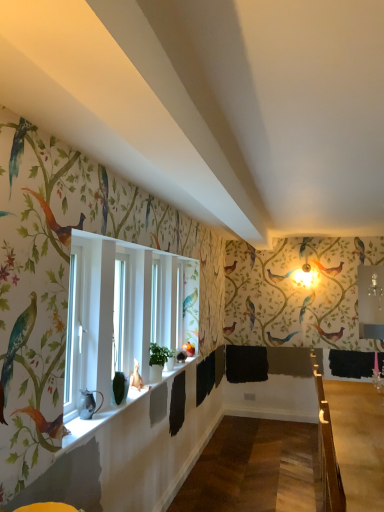
Question: Is white glossy window sill at lower center completely or partially inside matte black pitcher at window?

Choices:
 (A) no
 (B) yes

Answer: (A)

Question: Is matte black pitcher at window thinner than white glossy window sill at lower center?

Choices:
 (A) yes
 (B) no

Answer: (A)

Question: Does matte black pitcher at window have a smaller size compared to white glossy window sill at lower center?

Choices:
 (A) no
 (B) yes

Answer: (B)

Question: Is matte black pitcher at window far away from white glossy window sill at lower center?

Choices:
 (A) yes
 (B) no

Answer: (B)

Question: From the image's perspective, is matte black pitcher at window below white glossy window sill at lower center?

Choices:
 (A) yes
 (B) no

Answer: (B)

Question: Is matte black pitcher at window at the left side of white glossy window sill at lower center?

Choices:
 (A) no
 (B) yes

Answer: (B)

Question: From a real-world perspective, is wooden at right located beneath matte black pitcher at window?

Choices:
 (A) no
 (B) yes

Answer: (B)

Question: Does wooden at right have a lesser width compared to matte black pitcher at window?

Choices:
 (A) yes
 (B) no

Answer: (B)

Question: Is wooden at right positioned in front of matte black pitcher at window?

Choices:
 (A) yes
 (B) no

Answer: (B)

Question: Is wooden at right to the left of matte black pitcher at window from the viewer's perspective?

Choices:
 (A) no
 (B) yes

Answer: (A)

Question: Is wooden at right far from matte black pitcher at window?

Choices:
 (A) yes
 (B) no

Answer: (A)

Question: Is wooden at right further to the viewer compared to matte black pitcher at window?

Choices:
 (A) no
 (B) yes

Answer: (B)

Question: Is white glossy window sill at lower center thinner than wooden at right?

Choices:
 (A) no
 (B) yes

Answer: (B)